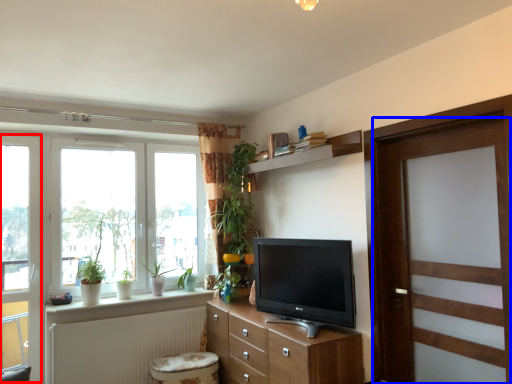
Question: Which of the following is the closest to the observer, glass door (highlighted by a red box) or door (highlighted by a blue box)?

Choices:
 (A) glass door
 (B) door

Answer: (B)